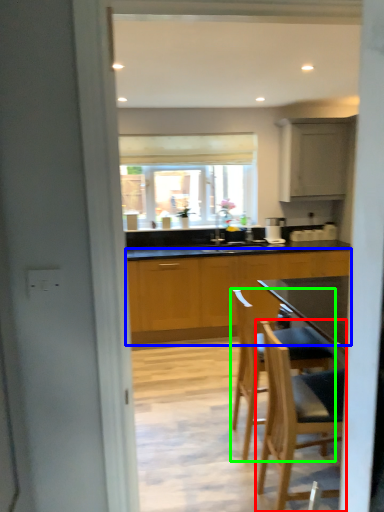
Question: Based on their relative distances, which object is nearer to chair (highlighted by a red box)? Choose from cabinetry (highlighted by a blue box) and chair (highlighted by a green box).

Choices:
 (A) cabinetry
 (B) chair

Answer: (B)